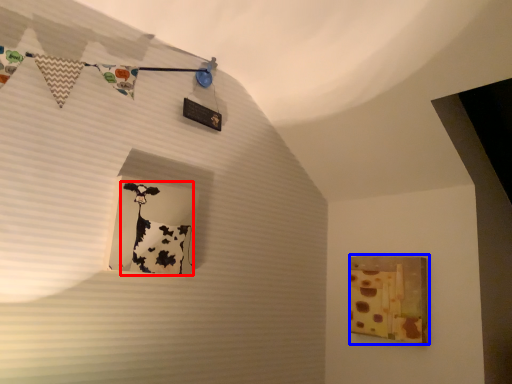
Question: Which object appears closest to the camera in this image, art (highlighted by a red box) or picture frame (highlighted by a blue box)?

Choices:
 (A) art
 (B) picture frame

Answer: (A)